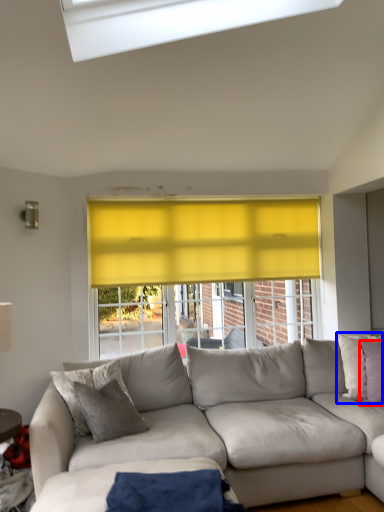
Question: Which of the following is the closest to the observer, pillow (highlighted by a red box) or pillow (highlighted by a blue box)?

Choices:
 (A) pillow
 (B) pillow

Answer: (A)